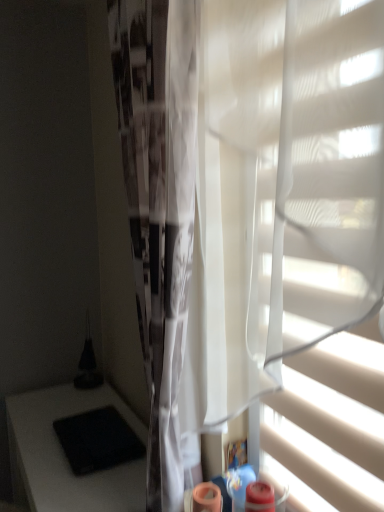
The height and width of the screenshot is (512, 384). Identify the location of vacant area on top of black matte table at lower left (from a real-world perspective). (57, 440).